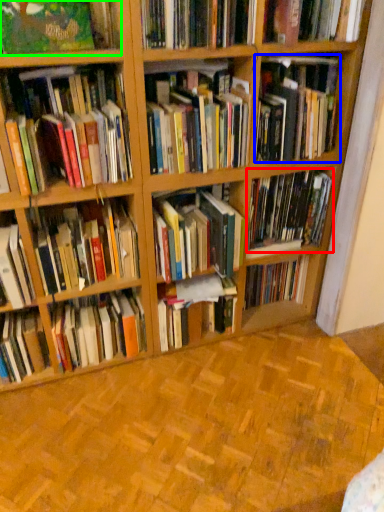
Question: Which object is the farthest from book (highlighted by a red box)? Choose among these: book (highlighted by a blue box) or book (highlighted by a green box).

Choices:
 (A) book
 (B) book

Answer: (B)